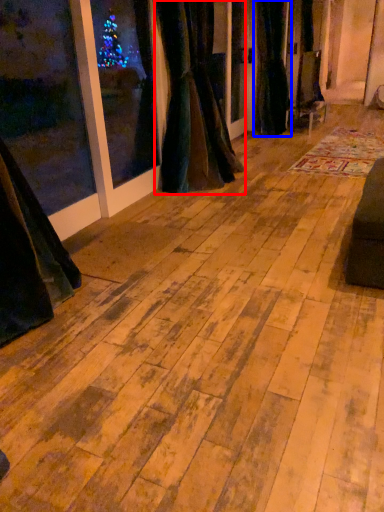
Question: Which object is further to the camera taking this photo, curtain (highlighted by a red box) or curtain (highlighted by a blue box)?

Choices:
 (A) curtain
 (B) curtain

Answer: (B)